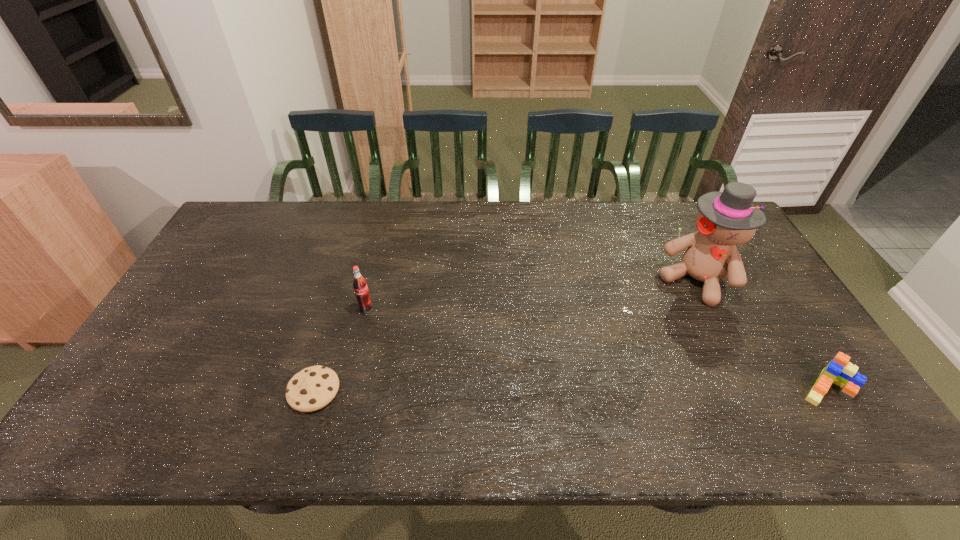
This screenshot has width=960, height=540. I want to click on the shortest object, so click(311, 389).

The width and height of the screenshot is (960, 540). What are the coordinates of `the rightmost object` in the screenshot? It's located at (840, 371).

At what (x,y) coordinates should I click in order to perform the action: click on the third tallest object. Please return your answer as a coordinate pair (x, y). This screenshot has width=960, height=540. Looking at the image, I should click on (840, 371).

The image size is (960, 540). What are the coordinates of `the tallest object` in the screenshot? It's located at (725, 219).

This screenshot has width=960, height=540. In order to click on the second object from right to left in this screenshot , I will do `click(725, 219)`.

Where is `the second tallest object`? This screenshot has width=960, height=540. the second tallest object is located at coordinates (361, 290).

Identify the location of vacant space situated 0.190m on the back of the cookie. (338, 313).

The width and height of the screenshot is (960, 540). I want to click on vacant area situated 0.400m on the left of the rightmost object, so click(x=636, y=387).

Identify the location of vacant space located 0.400m on the front-facing side of the third object from left to right. (612, 392).

Where is `vacant space positioned 0.330m on the front-facing side of the third object from left to right`? The image size is (960, 540). vacant space positioned 0.330m on the front-facing side of the third object from left to right is located at coordinates (625, 373).